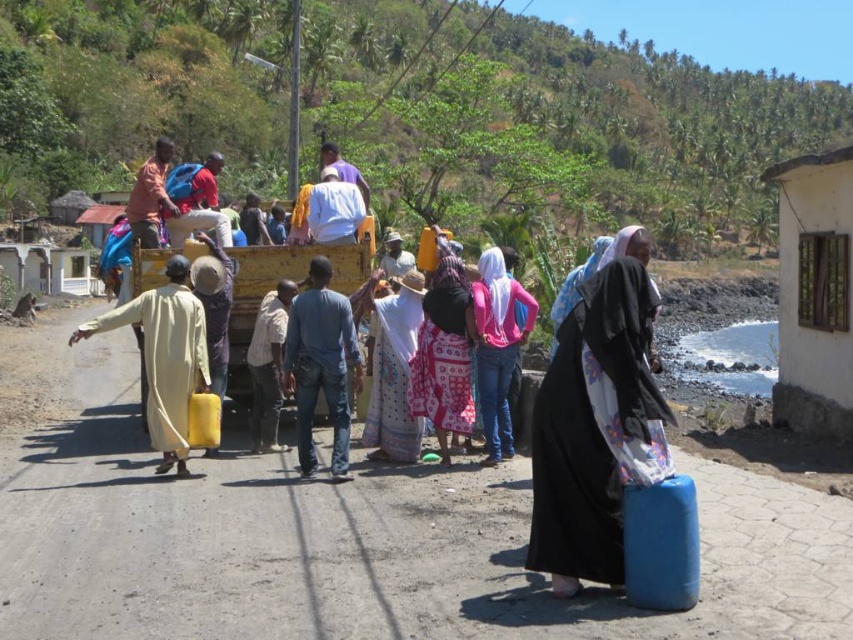
Question: Among these points, which one is nearest to the camera?

Choices:
 (A) (395, 321)
 (B) (614, 515)
 (C) (242, 337)

Answer: (B)

Question: Considering the real-world distances, which object is closest to the white printed dress at center?

Choices:
 (A) yellow matte wagon at center
 (B) blue fabric bag at lower right
 (C) pink fabric dress at center

Answer: (C)

Question: Which point is farther from the camera taking this photo?

Choices:
 (A) pyautogui.click(x=579, y=342)
 (B) pyautogui.click(x=405, y=282)

Answer: (B)

Question: Can you confirm if yellow matte wagon at center is thinner than pink fabric dress at center?

Choices:
 (A) no
 (B) yes

Answer: (A)

Question: Where is blue fabric bag at lower right located in relation to pink fabric dress at center in the image?

Choices:
 (A) right
 (B) left

Answer: (A)

Question: Does blue fabric bag at lower right lie behind white printed dress at center?

Choices:
 (A) no
 (B) yes

Answer: (A)